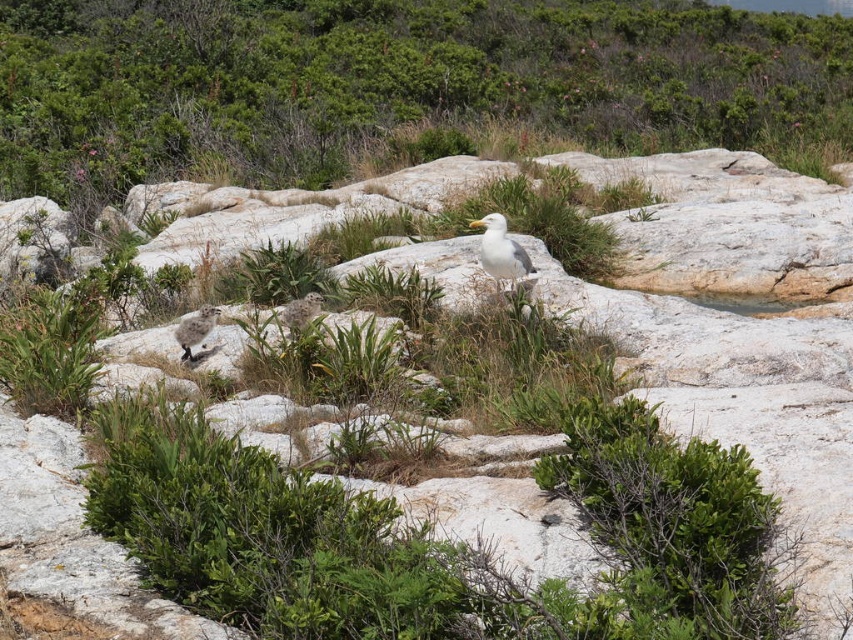
You are a hiker who wants to take a photo of the white feathered bird at center and the speckled feathered chick at lower left. Which bird should you aim your camera at first if you want to capture both in a single shot without moving the camera?

You should aim your camera at the white feathered bird at center first because it is above the speckled feathered chick at lower left, so adjusting the camera to include both would require framing from the higher position down.

You are a bird flying over the rocky terrain and want to land on the green leafy shrubs at upper center. Based on the coordinates provided, can you determine if the shrubs are positioned in the upper half of the image?

The green leafy shrubs at upper center are located at point coordinates with a y value of 0.458. Since the y value is less than 0.5, the shrubs are positioned in the lower half of the image, not the upper half.